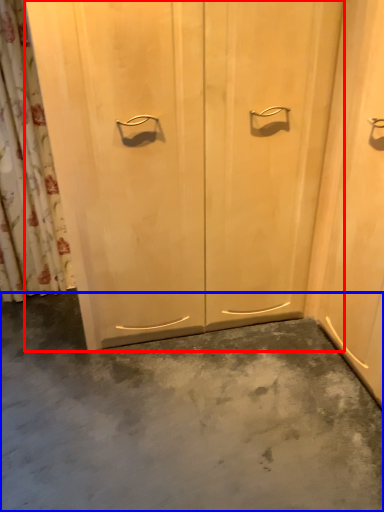
Question: Which of the following is the closest to the observer, door (highlighted by a red box) or concrete (highlighted by a blue box)?

Choices:
 (A) door
 (B) concrete

Answer: (B)